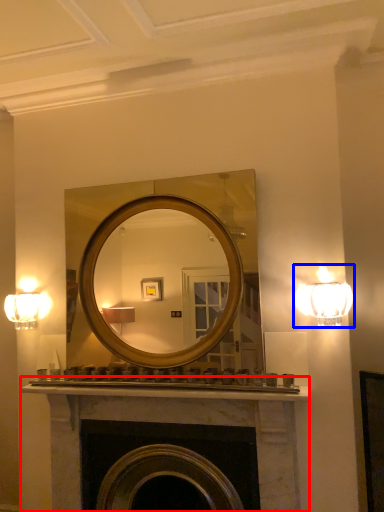
Question: Among these objects, which one is farthest to the camera, fireplace (highlighted by a red box) or lamp (highlighted by a blue box)?

Choices:
 (A) fireplace
 (B) lamp

Answer: (A)